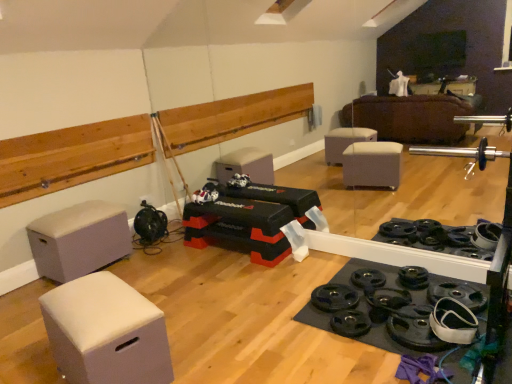
Question: Is gray fabric ottoman at left, the first furniture positioned from the left, located within white fabric ottoman at lower left, positioned as the 1th furniture in right-to-left order?

Choices:
 (A) yes
 (B) no

Answer: (B)

Question: Is white fabric ottoman at lower left, positioned as the 1th furniture in right-to-left order, placed right next to gray fabric ottoman at left, the first furniture positioned from the left?

Choices:
 (A) no
 (B) yes

Answer: (A)

Question: Can you confirm if white fabric ottoman at lower left, which ranks as the second furniture in left-to-right order, is thinner than gray fabric ottoman at left, the first furniture positioned from the left?

Choices:
 (A) yes
 (B) no

Answer: (A)

Question: Is white fabric ottoman at lower left, positioned as the 1th furniture in right-to-left order, shorter than gray fabric ottoman at left, which is the 2th furniture from right to left?

Choices:
 (A) no
 (B) yes

Answer: (B)

Question: Is white fabric ottoman at lower left, acting as the second furniture starting from the back, bigger than gray fabric ottoman at left, the 1th furniture in the back-to-front sequence?

Choices:
 (A) no
 (B) yes

Answer: (A)

Question: Considering the relative positions of white fabric ottoman at lower left, the 1th furniture in the front-to-back sequence, and gray fabric ottoman at left, the 1th furniture in the back-to-front sequence, in the image provided, is white fabric ottoman at lower left, the 1th furniture in the front-to-back sequence, to the right of gray fabric ottoman at left, the 1th furniture in the back-to-front sequence, from the viewer's perspective?

Choices:
 (A) yes
 (B) no

Answer: (A)

Question: Does white fabric ottoman at lower left, which ranks as the second furniture in left-to-right order, have a lesser width compared to matte plastic toy at center?

Choices:
 (A) no
 (B) yes

Answer: (A)

Question: Is white fabric ottoman at lower left, acting as the second furniture starting from the back, far from matte plastic toy at center?

Choices:
 (A) yes
 (B) no

Answer: (A)

Question: Is white fabric ottoman at lower left, the 1th furniture in the front-to-back sequence, facing towards matte plastic toy at center?

Choices:
 (A) yes
 (B) no

Answer: (B)

Question: Can we say white fabric ottoman at lower left, positioned as the 1th furniture in right-to-left order, lies outside matte plastic toy at center?

Choices:
 (A) yes
 (B) no

Answer: (A)

Question: Considering the relative sizes of white fabric ottoman at lower left, acting as the second furniture starting from the back, and matte plastic toy at center in the image provided, is white fabric ottoman at lower left, acting as the second furniture starting from the back, bigger than matte plastic toy at center?

Choices:
 (A) yes
 (B) no

Answer: (A)

Question: Considering the relative positions of white fabric ottoman at lower left, the 1th furniture in the front-to-back sequence, and matte plastic toy at center in the image provided, is white fabric ottoman at lower left, the 1th furniture in the front-to-back sequence, in front of matte plastic toy at center?

Choices:
 (A) yes
 (B) no

Answer: (A)

Question: Is matte plastic toy at center looking in the opposite direction of white fabric ottoman at lower left, positioned as the 1th furniture in right-to-left order?

Choices:
 (A) no
 (B) yes

Answer: (A)